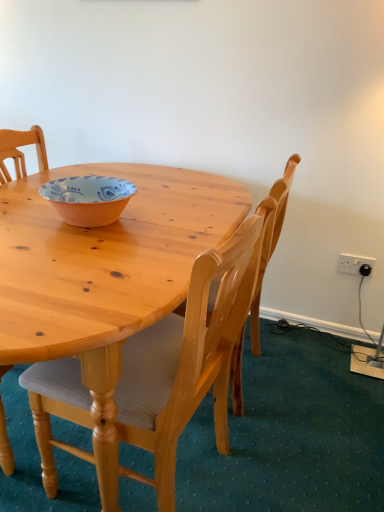
This screenshot has height=512, width=384. What do you see at coordinates (270, 239) in the screenshot?
I see `light brown wood chair at center, arranged as the first chair when viewed from the back` at bounding box center [270, 239].

Locate an element on the screen. light brown wood chair at center, which is the second chair in front-to-back order is located at coordinates (270, 239).

Describe the element at coordinates (88, 199) in the screenshot. I see `orange glazed bowl at center` at that location.

At what (x,y) coordinates should I click in order to perform the action: click on light brown wood chair at center, arranged as the first chair when viewed from the back. Please return your answer as a coordinate pair (x, y). This screenshot has height=512, width=384. Looking at the image, I should click on (270, 239).

From the image's perspective, does orange glazed bowl at center appear higher than light wood chair at center, the 2th chair from the back?

Yes.

Is orange glazed bowl at center completely or partially outside of light wood chair at center, the 2th chair from the back?

Absolutely, orange glazed bowl at center is external to light wood chair at center, the 2th chair from the back.

Which object is positioned more to the left, orange glazed bowl at center or light wood chair at center, the 2th chair from the back?

Positioned to the left is orange glazed bowl at center.

Is orange glazed bowl at center in front of light wood chair at center, the first chair positioned from the front?

No.

Which of these two, white plastic power outlet at upper right or orange glazed bowl at center, stands shorter?

orange glazed bowl at center.

Is white plastic power outlet at upper right further to the viewer compared to orange glazed bowl at center?

Yes, it is behind orange glazed bowl at center.

In terms of size, does white plastic power outlet at upper right appear bigger or smaller than orange glazed bowl at center?

In the image, white plastic power outlet at upper right appears to be smaller than orange glazed bowl at center.

Does light brown wood chair at center, arranged as the first chair when viewed from the back, have a lesser height compared to light wood chair at center, the 2th chair from the back?

No.

Which point is more forward, (273, 224) or (161, 430)?

The point (161, 430) is closer to the camera.

Locate an element on the screen. This screenshot has height=512, width=384. chair located on the left of light brown wood chair at center, arranged as the first chair when viewed from the back is located at coordinates (188, 357).

Locate an element on the screen. This screenshot has width=384, height=512. the 2nd chair positioned below the white plastic power outlet at upper right (from the image's perspective) is located at coordinates (188, 357).

Looking at this image, measure the distance from white plastic power outlet at upper right to light wood chair at center, the 2th chair from the back.

white plastic power outlet at upper right is 3.62 feet away from light wood chair at center, the 2th chair from the back.

Which point is more forward, (339, 263) or (214, 357)?

The point (214, 357) is closer to the camera.

From a real-world perspective, does orange glazed bowl at center stand above light brown wood chair at center, arranged as the first chair when viewed from the back?

Yes, from a real-world perspective, orange glazed bowl at center is over light brown wood chair at center, arranged as the first chair when viewed from the back

Which of these two, orange glazed bowl at center or light brown wood chair at center, which is the second chair in front-to-back order, stands taller?

light brown wood chair at center, which is the second chair in front-to-back order, is taller.

Which point is more distant from viewer, (90, 223) or (275, 196)?

The point (90, 223) is farther.

Considering the relative positions of white plastic power outlet at upper right and light brown wood chair at center, arranged as the first chair when viewed from the back, in the image provided, is white plastic power outlet at upper right to the right of light brown wood chair at center, arranged as the first chair when viewed from the back, from the viewer's perspective?

Yes.

Is white plastic power outlet at upper right bigger than light brown wood chair at center, which is the second chair in front-to-back order?

No, white plastic power outlet at upper right is not bigger than light brown wood chair at center, which is the second chair in front-to-back order.

Looking at this image, from the image's perspective, which one is positioned higher, white plastic power outlet at upper right or light brown wood chair at center, arranged as the first chair when viewed from the back?

white plastic power outlet at upper right, from the image's perspective.

From the image's perspective, which one is positioned lower, light wood chair at center, the 2th chair from the back, or white plastic power outlet at upper right?

light wood chair at center, the 2th chair from the back, from the image's perspective.

Considering the relative sizes of light wood chair at center, the first chair positioned from the front, and white plastic power outlet at upper right in the image provided, is light wood chair at center, the first chair positioned from the front, smaller than white plastic power outlet at upper right?

Actually, light wood chair at center, the first chair positioned from the front, might be larger than white plastic power outlet at upper right.

Can you confirm if light wood chair at center, the 2th chair from the back, is wider than white plastic power outlet at upper right?

Yes.

Identify the location of the 2nd chair positioned below the orange glazed bowl at center (from the image's perspective). (188, 357).

In the image, there is a orange glazed bowl at center. At what (x,y) coordinates should I click in order to perform the action: click on power outlet below it (from a real-world perspective). Please return your answer as a coordinate pair (x, y). The image size is (384, 512). Looking at the image, I should click on (354, 263).

When comparing their distances from orange glazed bowl at center, does light brown wood chair at center, arranged as the first chair when viewed from the back, or white plastic power outlet at upper right seem closer?

Among the two, light brown wood chair at center, arranged as the first chair when viewed from the back, is located nearer to orange glazed bowl at center.

Looking at this image, when comparing their distances from orange glazed bowl at center, does light brown wood chair at center, arranged as the first chair when viewed from the back, or light wood chair at center, the first chair positioned from the front, seem further?

The object further to orange glazed bowl at center is light brown wood chair at center, arranged as the first chair when viewed from the back.

Estimate the real-world distances between objects in this image. Which object is closer to white plastic power outlet at upper right, light brown wood chair at center, arranged as the first chair when viewed from the back, or light wood chair at center, the 2th chair from the back?

The object closer to white plastic power outlet at upper right is light brown wood chair at center, arranged as the first chair when viewed from the back.

Based on their spatial positions, is light brown wood chair at center, arranged as the first chair when viewed from the back, or orange glazed bowl at center further from white plastic power outlet at upper right?

The object further to white plastic power outlet at upper right is orange glazed bowl at center.

Considering their positions, is white plastic power outlet at upper right positioned closer to orange glazed bowl at center than light brown wood chair at center, arranged as the first chair when viewed from the back?

The object closer to orange glazed bowl at center is light brown wood chair at center, arranged as the first chair when viewed from the back.

Estimate the real-world distances between objects in this image. Which object is closer to light brown wood chair at center, which is the second chair in front-to-back order, light wood chair at center, the first chair positioned from the front, or white plastic power outlet at upper right?

light wood chair at center, the first chair positioned from the front, lies closer to light brown wood chair at center, which is the second chair in front-to-back order, than the other object.

Based on their spatial positions, is orange glazed bowl at center or light brown wood chair at center, which is the second chair in front-to-back order, further from light wood chair at center, the 2th chair from the back?

orange glazed bowl at center lies further to light wood chair at center, the 2th chair from the back, than the other object.

Based on their spatial positions, is orange glazed bowl at center or white plastic power outlet at upper right closer to light wood chair at center, the first chair positioned from the front?

orange glazed bowl at center.

Identify the location of bowl located between light wood chair at center, the 2th chair from the back, and white plastic power outlet at upper right in the depth direction. pos(88,199).

The image size is (384, 512). In order to click on bowl between light wood chair at center, the 2th chair from the back, and light brown wood chair at center, which is the second chair in front-to-back order, along the z-axis in this screenshot , I will do `click(88, 199)`.

The height and width of the screenshot is (512, 384). What are the coordinates of `chair between light wood chair at center, the first chair positioned from the front, and white plastic power outlet at upper right in the front-back direction` in the screenshot? It's located at (270, 239).